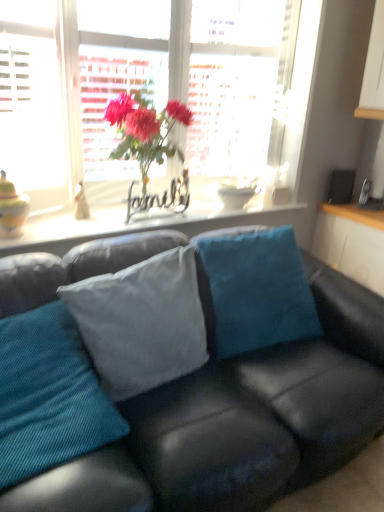
Question: Should I look upward or downward to see teal corduroy pillow at center, which appears as the 1th pillow when viewed from the left?

Choices:
 (A) up
 (B) down

Answer: (B)

Question: Which direction should I rotate to look at light blue fabric pillow at center, positioned as the second pillow in right-to-left order?

Choices:
 (A) right
 (B) left

Answer: (B)

Question: Is white glossy cabinet at right turned away from matte yellow vase at left?

Choices:
 (A) no
 (B) yes

Answer: (A)

Question: Is white glossy cabinet at right to the right of matte yellow vase at left from the viewer's perspective?

Choices:
 (A) no
 (B) yes

Answer: (B)

Question: Does white glossy cabinet at right come in front of matte yellow vase at left?

Choices:
 (A) no
 (B) yes

Answer: (A)

Question: Can you confirm if white glossy cabinet at right is thinner than matte yellow vase at left?

Choices:
 (A) no
 (B) yes

Answer: (A)

Question: Does white glossy cabinet at right have a greater width compared to matte yellow vase at left?

Choices:
 (A) no
 (B) yes

Answer: (B)

Question: Is the depth of white glossy cabinet at right greater than that of matte yellow vase at left?

Choices:
 (A) yes
 (B) no

Answer: (A)

Question: Does matte glass window at upper center come in front of white glossy cabinet at right?

Choices:
 (A) no
 (B) yes

Answer: (B)

Question: Is matte glass window at upper center next to white glossy cabinet at right?

Choices:
 (A) yes
 (B) no

Answer: (B)

Question: Is matte glass window at upper center facing away from white glossy cabinet at right?

Choices:
 (A) no
 (B) yes

Answer: (A)

Question: From the image's perspective, is matte glass window at upper center located above white glossy cabinet at right?

Choices:
 (A) no
 (B) yes

Answer: (B)

Question: Considering the relative sizes of matte glass window at upper center and white glossy cabinet at right in the image provided, is matte glass window at upper center wider than white glossy cabinet at right?

Choices:
 (A) yes
 (B) no

Answer: (A)

Question: Can you confirm if matte glass window at upper center is bigger than white glossy cabinet at right?

Choices:
 (A) no
 (B) yes

Answer: (B)

Question: Considering the relative sizes of light blue fabric pillow at center, marked as the second pillow in a left-to-right arrangement, and white glossy cabinet at right in the image provided, is light blue fabric pillow at center, marked as the second pillow in a left-to-right arrangement, wider than white glossy cabinet at right?

Choices:
 (A) yes
 (B) no

Answer: (B)